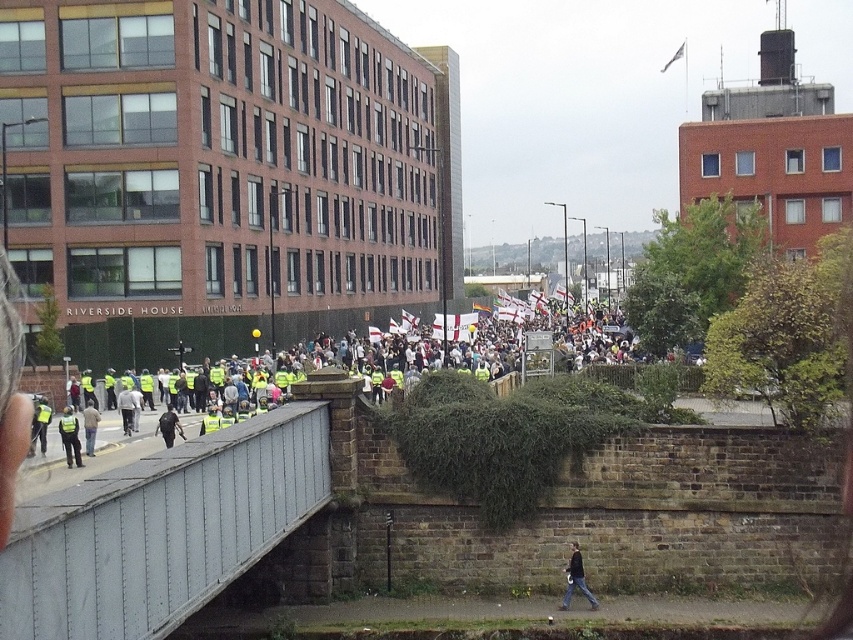
Question: Is white metal pedestrian bridge at lower left smaller than dark blue jacket at center?

Choices:
 (A) yes
 (B) no

Answer: (B)

Question: Which of these objects is positioned farthest from the dark gray jacket at lower right?

Choices:
 (A) yellow reflective vest at center
 (B) light brown leather jacket at lower left

Answer: (B)

Question: Estimate the real-world distances between objects in this image. Which object is closer to the dark gray jacket at lower right?

Choices:
 (A) reflective yellow vest at left
 (B) light gray fabric jacket at center
 (C) white metal pedestrian bridge at lower left
 (D) dark blue jacket at center

Answer: (C)

Question: Does white metal pedestrian bridge at lower left have a lesser width compared to light brown leather jacket at lower left?

Choices:
 (A) yes
 (B) no

Answer: (A)

Question: Does reflective yellow vest at lower left have a greater width compared to dark blue jacket at center?

Choices:
 (A) no
 (B) yes

Answer: (B)

Question: Among these points, which one is nearest to the camera?

Choices:
 (A) (91, 400)
 (B) (202, 426)

Answer: (B)